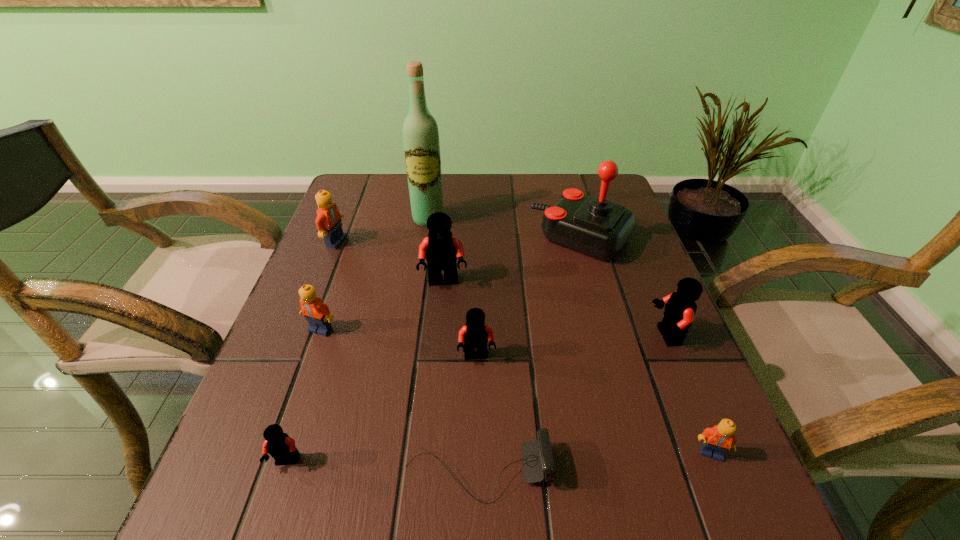
Locate an element on the screen. This screenshot has width=960, height=540. vacant space located on the front-facing side of the rightmost black Lego is located at coordinates (597, 336).

This screenshot has width=960, height=540. What are the coordinates of `free spot located 0.210m on the front-facing side of the rightmost black Lego` in the screenshot? It's located at (548, 336).

Locate an element on the screen. This screenshot has width=960, height=540. vacant space located on the front-facing side of the rightmost black Lego is located at coordinates (493, 336).

Where is `free space located on the front-facing side of the second nearest orange Lego`? The width and height of the screenshot is (960, 540). free space located on the front-facing side of the second nearest orange Lego is located at coordinates (267, 482).

Where is `vacant area situated on the front-facing side of the third biggest black Lego`? Image resolution: width=960 pixels, height=540 pixels. vacant area situated on the front-facing side of the third biggest black Lego is located at coordinates (476, 424).

Where is `vacant region located 0.060m on the front-facing side of the smallest orange Lego`? vacant region located 0.060m on the front-facing side of the smallest orange Lego is located at coordinates (731, 501).

Where is `free point located on the front-facing side of the nearest black Lego`? free point located on the front-facing side of the nearest black Lego is located at coordinates (271, 514).

Find the location of a particular element. This screenshot has height=540, width=960. vacant region located 0.170m on the front-facing side of the shortest object is located at coordinates (660, 471).

The image size is (960, 540). I want to click on wine bottle that is at the far edge, so click(421, 143).

I want to click on joystick that is at the far edge, so click(595, 226).